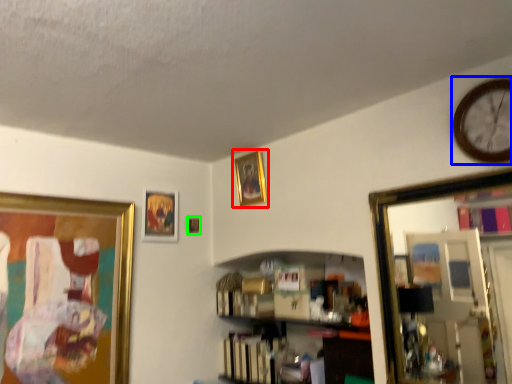
Question: Which is nearer to the picture frame (highlighted by a red box)? clock (highlighted by a blue box) or picture frame (highlighted by a green box).

Choices:
 (A) clock
 (B) picture frame

Answer: (B)